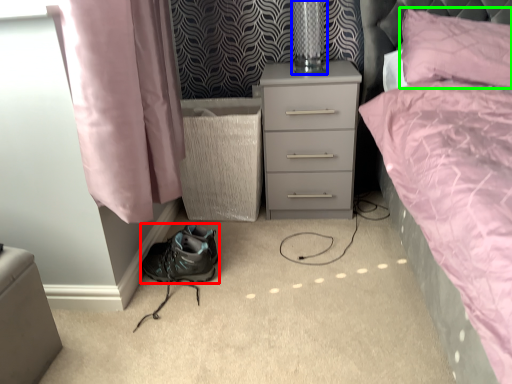
Question: Estimate the real-world distances between objects in this image. Which object is farther from shoe (highlighted by a red box), table lamp (highlighted by a blue box) or pillow (highlighted by a green box)?

Choices:
 (A) table lamp
 (B) pillow

Answer: (B)